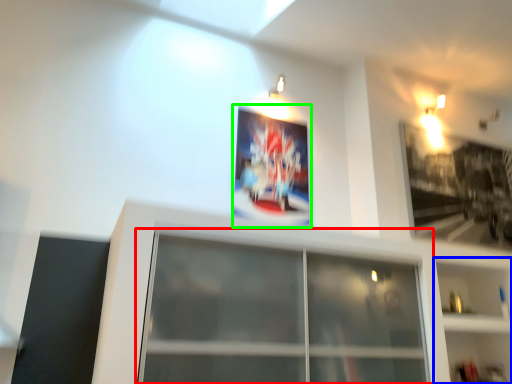
Question: Estimate the real-world distances between objects in this image. Which object is closer to window (highlighted by a red box), shelf (highlighted by a blue box) or picture frame (highlighted by a green box)?

Choices:
 (A) shelf
 (B) picture frame

Answer: (A)